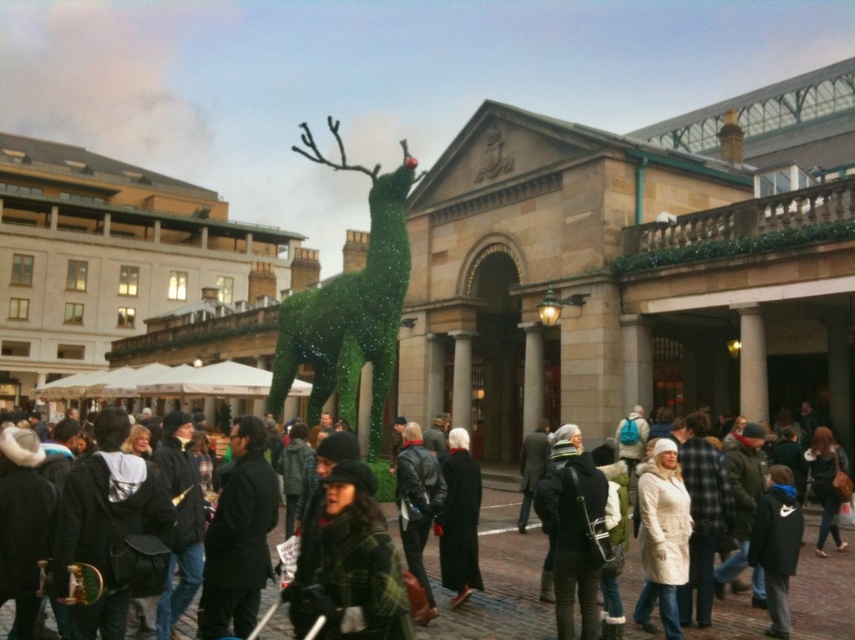
Can you confirm if white woolen hat at center is positioned above leather jacket at center?

No, white woolen hat at center is not above leather jacket at center.

Is point (558, 628) positioned after point (411, 561)?

No, (558, 628) is in front of (411, 561).

The image size is (855, 640). What do you see at coordinates (572, 532) in the screenshot? I see `white woolen hat at center` at bounding box center [572, 532].

At what (x,y) coordinates should I click in order to perform the action: click on white woolen hat at center. Please return your answer as a coordinate pair (x, y). Image resolution: width=855 pixels, height=640 pixels. Looking at the image, I should click on (572, 532).

Can you confirm if white woolen hat at center is bigger than matte black coat at center?

No.

How much distance is there between white woolen hat at center and matte black coat at center?

white woolen hat at center is 5.06 meters away from matte black coat at center.

You are a GUI agent. You are given a task and a screenshot of the screen. Output one action in this format:
    pyautogui.click(x=<x>, y=<y>)
    Task: Click on the white woolen hat at center
    
    Given the screenshot: What is the action you would take?
    pyautogui.click(x=572, y=532)

Is green glittery reindeer at center taller than matte black coat at center?

Yes, green glittery reindeer at center is taller than matte black coat at center.

Is green glittery reindeer at center to the right of matte black coat at center from the viewer's perspective?

No, green glittery reindeer at center is not to the right of matte black coat at center.

This screenshot has width=855, height=640. I want to click on green glittery reindeer at center, so click(351, 305).